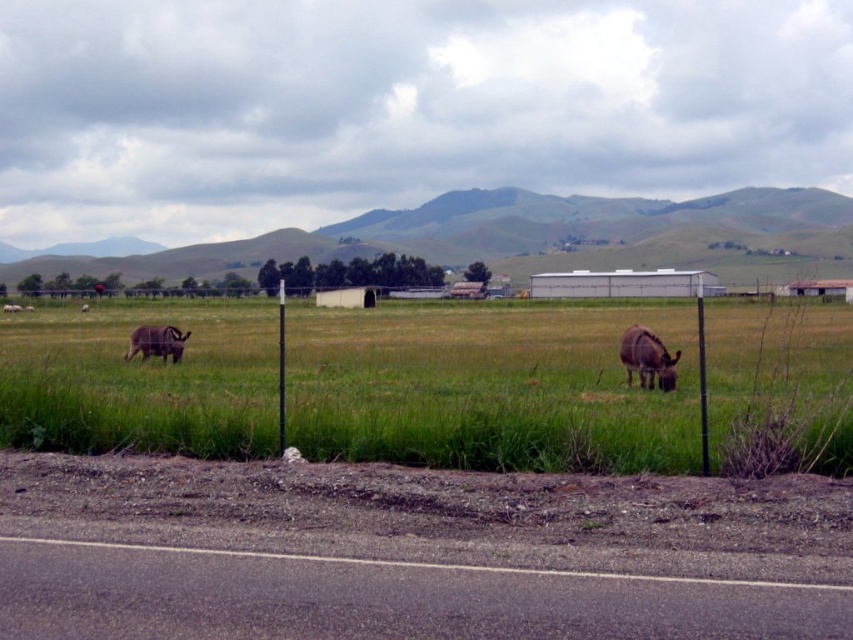
The width and height of the screenshot is (853, 640). Describe the element at coordinates (281, 369) in the screenshot. I see `black metal pole at center` at that location.

Between black metal pole at center and brown furry goat at left, which one is positioned higher?

black metal pole at center is above.

Who is more forward, (282, 365) or (4, 310)?

Positioned in front is point (282, 365).

This screenshot has width=853, height=640. I want to click on black metal pole at center, so click(x=281, y=369).

Can you confirm if brown fuzzy goat at left is wider than brown furry goat at left?

Incorrect, brown fuzzy goat at left's width does not surpass brown furry goat at left's.

Who is taller, brown fuzzy goat at left or brown furry goat at left?

brown fuzzy goat at left is taller.

Is point (180, 349) less distant than point (3, 310)?

Yes, point (180, 349) is in front of point (3, 310).

Where is `brown fuzzy goat at left`? This screenshot has width=853, height=640. brown fuzzy goat at left is located at coordinates (155, 342).

Who is taller, green grassy field at center or brown fuzzy goat at left?

Standing taller between the two is green grassy field at center.

In order to click on green grassy field at center in this screenshot , I will do `click(488, 387)`.

Locate an element on the screen. The height and width of the screenshot is (640, 853). green grassy field at center is located at coordinates (488, 387).